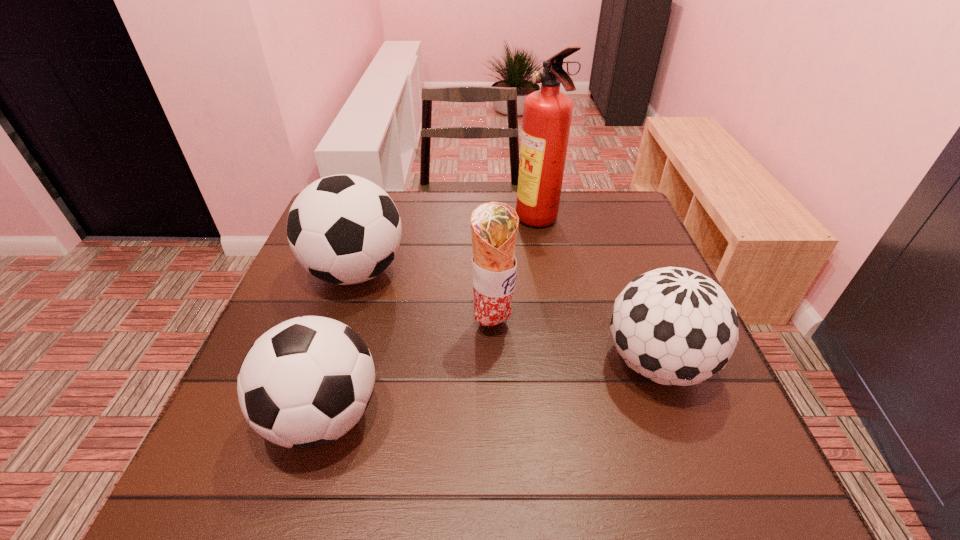
Identify the location of the second object from right to left. This screenshot has width=960, height=540. (547, 113).

This screenshot has height=540, width=960. I want to click on the tallest object, so click(x=547, y=113).

At what (x,y) coordinates should I click in order to perform the action: click on burrito. Please return your answer as a coordinate pair (x, y). Image resolution: width=960 pixels, height=540 pixels. Looking at the image, I should click on (494, 226).

Find the location of a particular element. The width and height of the screenshot is (960, 540). the farthest soccer ball is located at coordinates (343, 229).

The height and width of the screenshot is (540, 960). What are the coordinates of `the rightmost object` in the screenshot? It's located at (674, 326).

What are the coordinates of `free region located 0.260m on the front-facing side of the fire extinguisher` in the screenshot? It's located at (424, 222).

Identify the location of free space located on the front-facing side of the fire extinguisher. (481, 222).

The image size is (960, 540). In order to click on vacant area situated 0.210m on the front-facing side of the fire extinguisher in this screenshot , I will do `click(442, 222)`.

Where is `free space located on the right of the third object from right to left`? The image size is (960, 540). free space located on the right of the third object from right to left is located at coordinates (665, 325).

This screenshot has width=960, height=540. Identify the location of free space located 0.360m on the front of the farthest soccer ball. (294, 463).